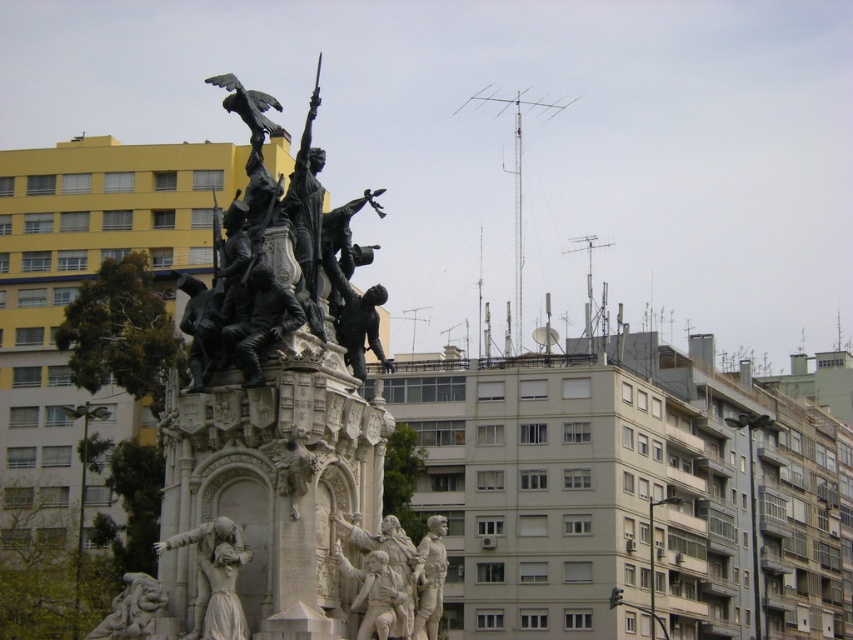
What do you see at coordinates (381, 579) in the screenshot?
I see `polished bronze figures at center` at bounding box center [381, 579].

Is polished bronze figures at center taller than polished bronze soldier at center?

Incorrect, polished bronze figures at center's height is not larger of polished bronze soldier at center's.

The width and height of the screenshot is (853, 640). What do you see at coordinates (381, 579) in the screenshot?
I see `polished bronze figures at center` at bounding box center [381, 579].

Locate an element on the screen. polished bronze figures at center is located at coordinates (381, 579).

Can you confirm if bronze statue at center is positioned above polished stone dragon at lower left?

Indeed, bronze statue at center is positioned over polished stone dragon at lower left.

Does bronze statue at center appear on the right side of polished stone dragon at lower left?

Correct, you'll find bronze statue at center to the right of polished stone dragon at lower left.

Which is in front, point (332, 280) or point (161, 602)?

Point (161, 602) is more forward.

Identify the location of bronze statue at center. Image resolution: width=853 pixels, height=640 pixels. (281, 426).

Who is lower down, bronze statue at center or polished bronze figures at center?

Positioned lower is polished bronze figures at center.

Who is more distant from viewer, (163, 413) or (357, 532)?

The point (163, 413) is behind.

I want to click on bronze statue at center, so click(x=281, y=426).

Locate an element on the screen. bronze statue at center is located at coordinates (281, 426).